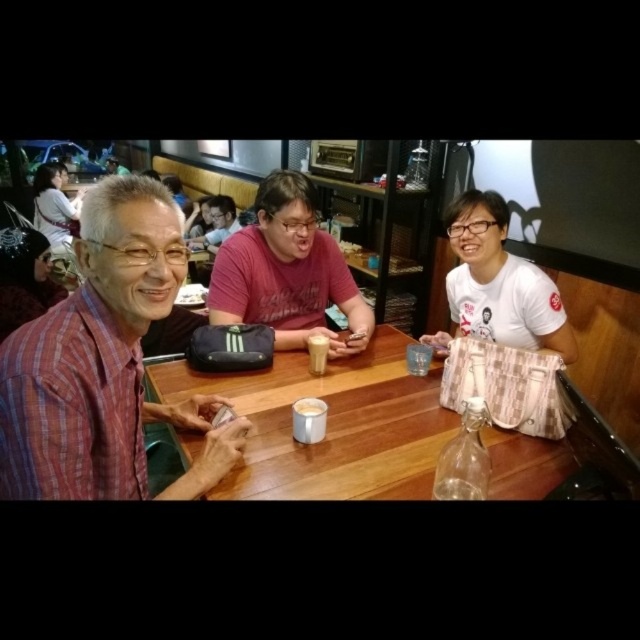
Question: Is wooden table at center wider than matte red shirt at center?

Choices:
 (A) no
 (B) yes

Answer: (B)

Question: Does wooden table at center appear under white frothy foam at center?

Choices:
 (A) yes
 (B) no

Answer: (B)

Question: Among these objects, which one is nearest to the camera?

Choices:
 (A) white fabric shirt at upper left
 (B) matte red shirt at center
 (C) white cotton shirt at center

Answer: (C)

Question: Which point is closer to the camera?

Choices:
 (A) (196, 296)
 (B) (296, 412)
 (C) (156, 296)
 (D) (49, 204)

Answer: (C)

Question: Which point is farther to the camera?

Choices:
 (A) plaid fabric shirt at left
 (B) white matte paper at upper center
 (C) wooden table at center
 (D) white frothy foam at center

Answer: (B)

Question: Does wooden table at center lie behind white fabric shirt at upper left?

Choices:
 (A) yes
 (B) no

Answer: (B)